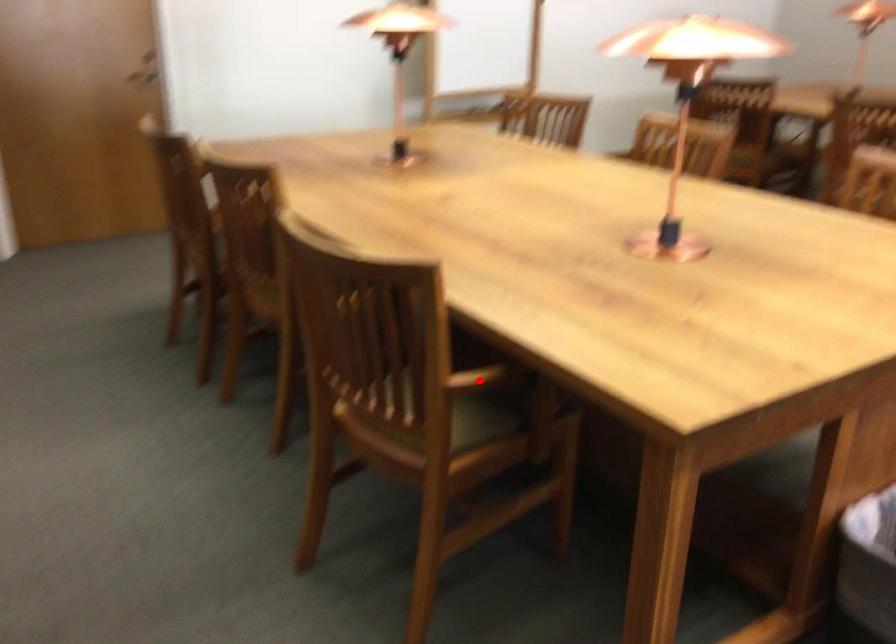
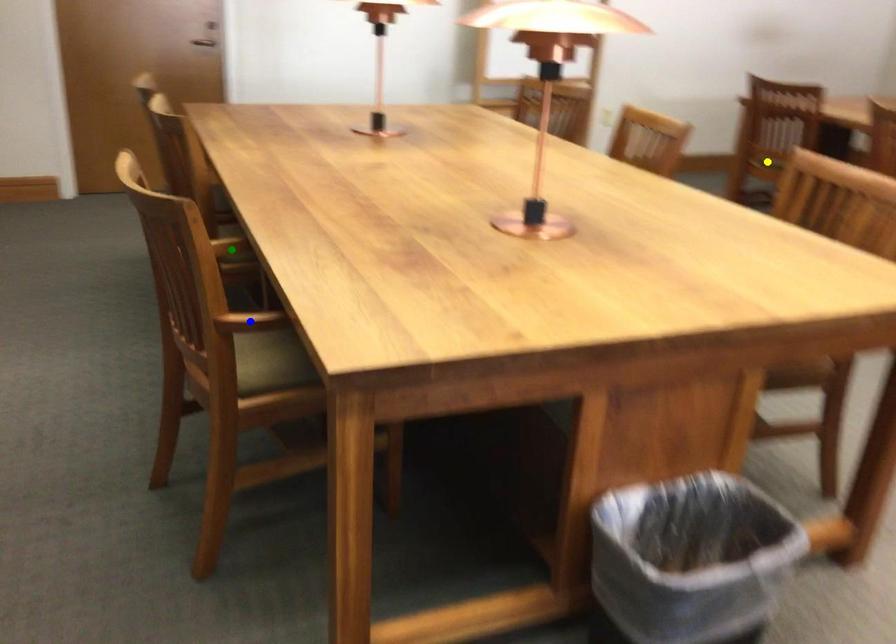
Question: I am providing you with two images of the same scene from different viewpoints. A red point is marked on the first image. You are given multiple points on the second image. Which spot in image 2 lines up with the point in image 1?

Choices:
 (A) blue point
 (B) yellow point
 (C) green point

Answer: (A)